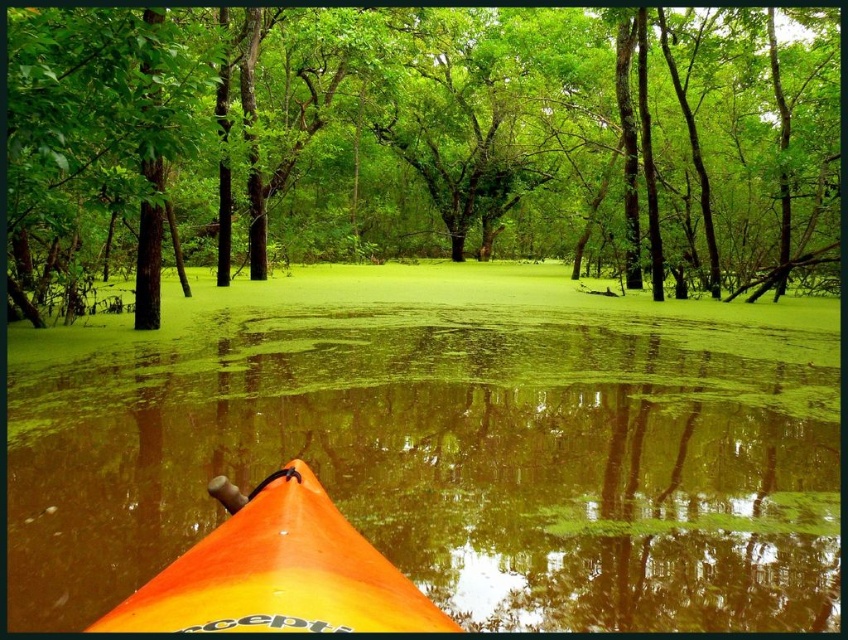
Question: Among these points, which one is nearest to the camera?

Choices:
 (A) (353, 604)
 (B) (420, 100)
 (C) (216, 326)

Answer: (A)

Question: Can you confirm if orange kayak at lower center is positioned to the left of green leafy tree at center?

Choices:
 (A) yes
 (B) no

Answer: (A)

Question: Estimate the real-world distances between objects in this image. Which object is farther from the orange kayak at lower center?

Choices:
 (A) green leafy tree at center
 (B) orange plastic kayak at lower center

Answer: (A)

Question: Is orange kayak at lower center smaller than green leafy tree at center?

Choices:
 (A) yes
 (B) no

Answer: (A)

Question: Which point is farther from the camera taking this photo?

Choices:
 (A) pyautogui.click(x=99, y=216)
 (B) pyautogui.click(x=453, y=612)
 (C) pyautogui.click(x=339, y=524)

Answer: (A)

Question: Is orange kayak at lower center further to the viewer compared to green leafy tree at center?

Choices:
 (A) no
 (B) yes

Answer: (A)